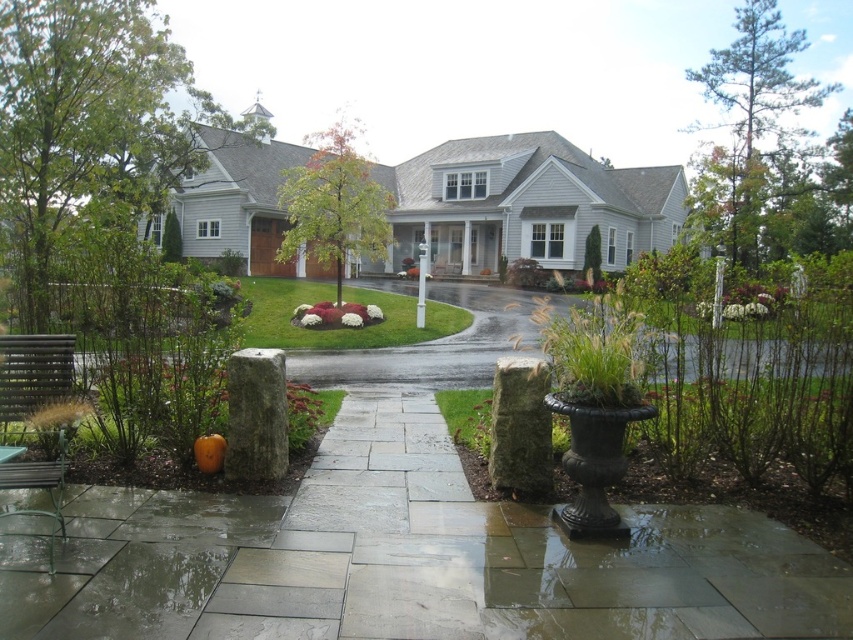
Question: In this image, where is gray siding house at center located relative to green grass at center?

Choices:
 (A) above
 (B) below

Answer: (A)

Question: Does gray stone pillar at center-left appear on the right side of green grass at center?

Choices:
 (A) no
 (B) yes

Answer: (A)

Question: Among these objects, which one is farthest from the camera?

Choices:
 (A) gray stone pillar at center-left
 (B) gray siding house at center

Answer: (B)

Question: Is green mossy stone pillar at center to the left of green grass at center from the viewer's perspective?

Choices:
 (A) yes
 (B) no

Answer: (B)

Question: Which object appears closest to the camera in this image?

Choices:
 (A) gray siding house at center
 (B) green grass at center

Answer: (B)

Question: Which point is closer to the camera?

Choices:
 (A) (645, 200)
 (B) (270, 404)

Answer: (B)